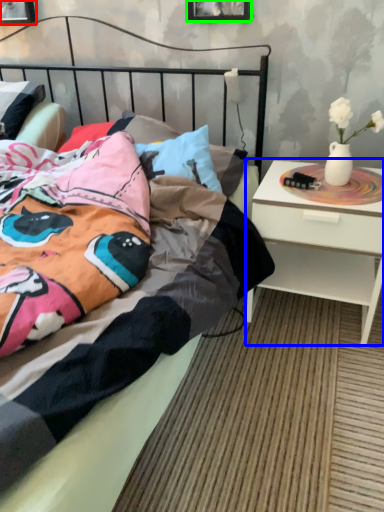
Question: Based on their relative distances, which object is nearer to picture frame (highlighted by a red box)? Choose from nightstand (highlighted by a blue box) and picture frame (highlighted by a green box).

Choices:
 (A) nightstand
 (B) picture frame

Answer: (B)